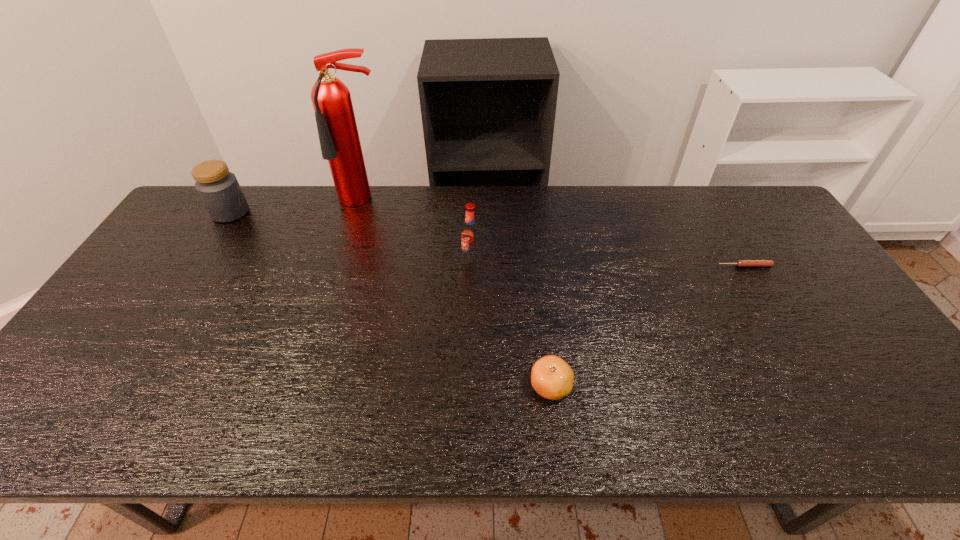
Where is `blank space that satisfies the following two spatial constraints: 1. at the nozzle of the rightmost object; 2. on the left side of the fourth object from right to left`? This screenshot has height=540, width=960. blank space that satisfies the following two spatial constraints: 1. at the nozzle of the rightmost object; 2. on the left side of the fourth object from right to left is located at coordinates (345, 266).

At what (x,y) coordinates should I click in order to perform the action: click on free spot that satisfies the following two spatial constraints: 1. at the nozzle of the fourth object from right to left; 2. on the surface of the jar near the warning symbol. Please return your answer as a coordinate pair (x, y). Looking at the image, I should click on 361,212.